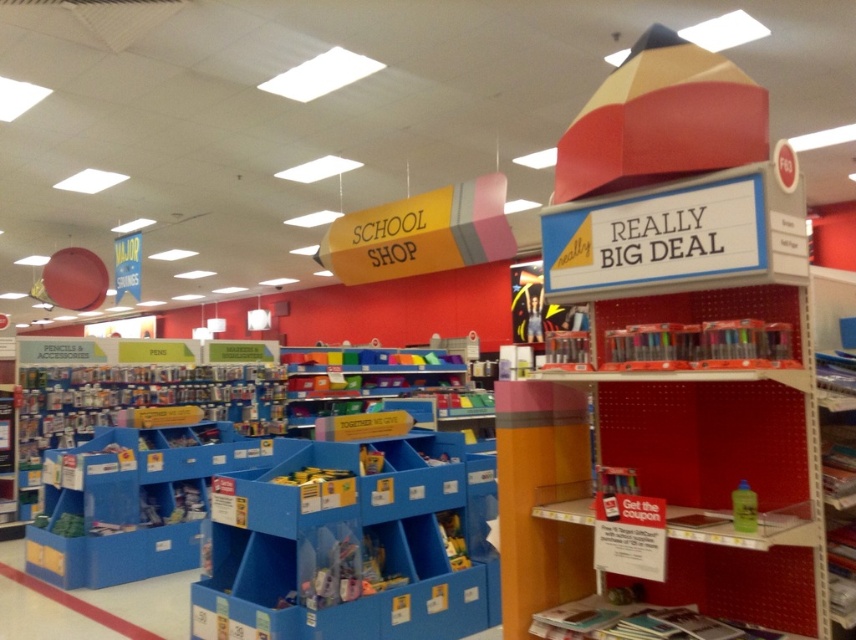
You are a customer looking to buy a taller item between the translucent plastic markers at upper right and the translucent yellow bottle at center right. Which one should you choose?

The translucent plastic markers at upper right are much taller than the translucent yellow bottle at center right, so you should choose the translucent plastic markers at upper right.

You are a store employee who needs to place an order for more items. You notice the translucent plastic markers at upper right and the blue plastic bins at lower left. Which item requires a larger storage space when ordering in bulk?

The blue plastic bins at lower left require larger storage space when ordering in bulk because they are bigger than the translucent plastic markers at upper right.